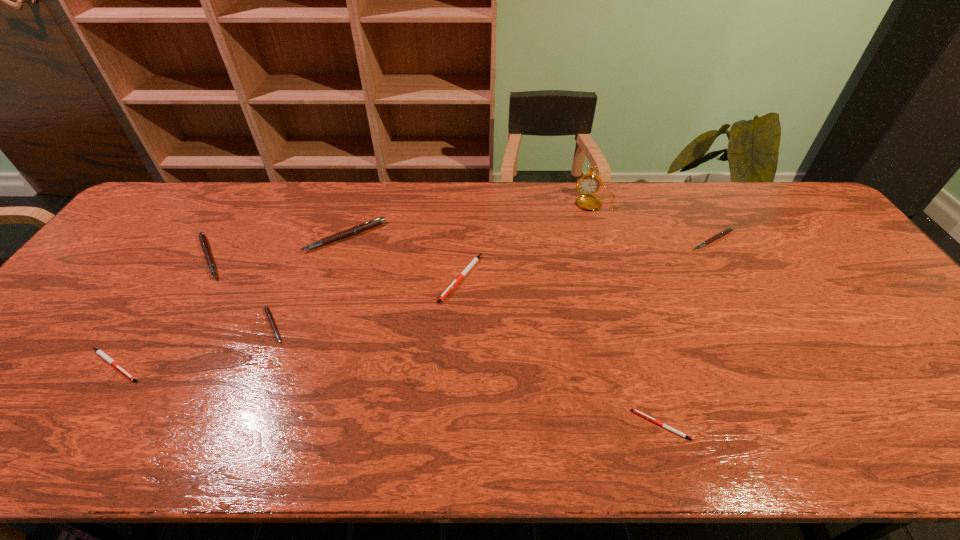
Locate an element on the screen. This screenshot has height=540, width=960. the fifth farthest pen is located at coordinates (268, 313).

Image resolution: width=960 pixels, height=540 pixels. What are the coordinates of `the third nearest object` in the screenshot? It's located at (268, 313).

Image resolution: width=960 pixels, height=540 pixels. Identify the location of the leftmost white pen. (99, 352).

Identify the location of the sixth farthest pen. This screenshot has width=960, height=540. (99, 352).

Locate an element on the screen. the smallest white pen is located at coordinates (637, 412).

I want to click on the sixth pen from left to right, so click(x=637, y=412).

Where is `free space located 0.160m on the face of the farthest object`? free space located 0.160m on the face of the farthest object is located at coordinates (609, 244).

You are a GUI agent. You are given a task and a screenshot of the screen. Output one action in this format:
    pyautogui.click(x=<x>, y=<y>)
    Task: Click on the vacant space located 0.390m at the nib of the biggest pink pen
    The height and width of the screenshot is (540, 960).
    Given the screenshot: What is the action you would take?
    pyautogui.click(x=303, y=367)

I want to click on blank space located 0.120m at the nib of the second tallest pen, so click(272, 258).

This screenshot has width=960, height=540. What are the coordinates of `vacant space situated 0.090m at the nib of the second smallest pink pen` in the screenshot? It's located at (732, 273).